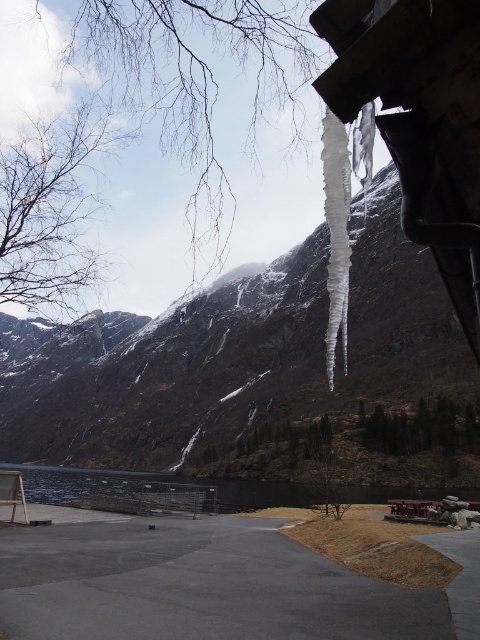
Does snowy rock mountain at upper center have a greater width compared to dark reflective water at center?

Indeed, snowy rock mountain at upper center has a greater width compared to dark reflective water at center.

Which is behind, point (13, 435) or point (10, 467)?

The point (13, 435) is behind.

Find the location of `snowy rock mountain at upper center`. snowy rock mountain at upper center is located at coordinates [x=235, y=355].